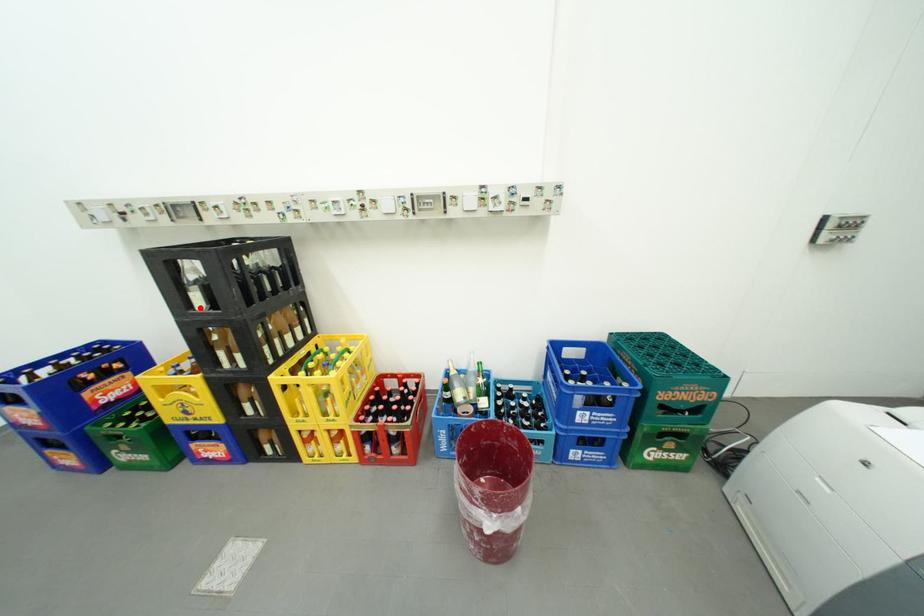
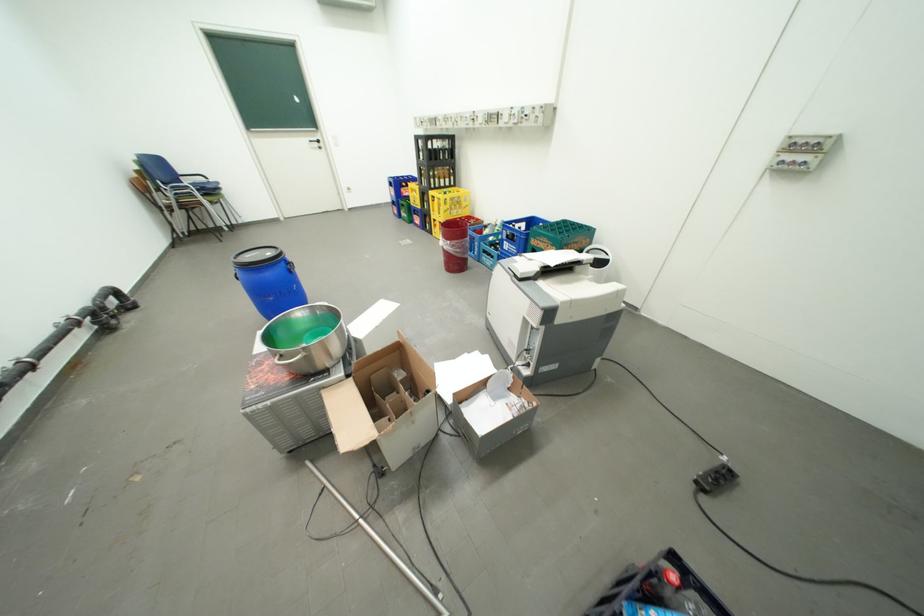
Question: I am providing you with two images of the same scene from different viewpoints. Given a red point in image1, look at the same physical point in image2. Is it:

Choices:
 (A) Closer to the viewpoint
 (B) Farther from the viewpoint

Answer: (A)